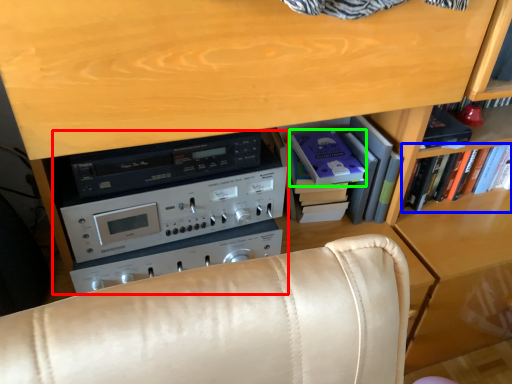
Question: Which is farther away from appliance (highlighted by a red box)? book (highlighted by a blue box) or paperback book (highlighted by a green box)?

Choices:
 (A) book
 (B) paperback book

Answer: (A)